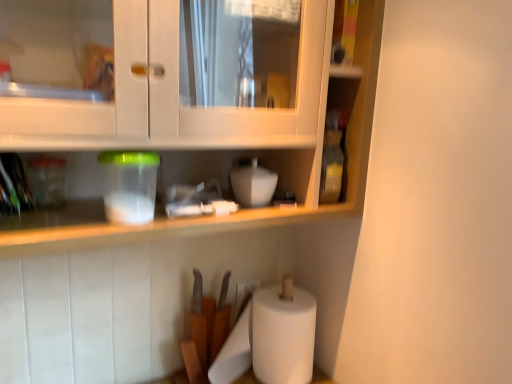
Find the location of a particular element. white matte bowl at center, positioned as the 1th appliance in back-to-front order is located at coordinates (253, 184).

Describe the element at coordinates (253, 184) in the screenshot. I see `white matte bowl at center, positioned as the 1th appliance in back-to-front order` at that location.

Where is `translucent plastic container at upper left, which is the 1th appliance in front-to-back order`? The width and height of the screenshot is (512, 384). translucent plastic container at upper left, which is the 1th appliance in front-to-back order is located at coordinates (129, 185).

What do you see at coordinates (129, 185) in the screenshot? I see `translucent plastic container at upper left, the 2th appliance from the back` at bounding box center [129, 185].

In order to face translucent plastic container at upper left, the 2th appliance from the back, should I rotate leftwards or rightwards?

A 15.944 degree turn to the left will do.

You are a GUI agent. You are given a task and a screenshot of the screen. Output one action in this format:
    pyautogui.click(x=<x>, y=<y>)
    Task: Click on the white matte bowl at center, which appears as the second appliance when viewed from the left
    The image size is (512, 384).
    Given the screenshot: What is the action you would take?
    pyautogui.click(x=253, y=184)

Which object is positioned more to the left, translucent plastic container at upper left, the 2th appliance from the back, or white matte bowl at center, which appears as the second appliance when viewed from the left?

Positioned to the left is translucent plastic container at upper left, the 2th appliance from the back.

Looking at this image, is translucent plastic container at upper left, which is the 1th appliance in front-to-back order, positioned before white matte bowl at center, acting as the 2th appliance starting from the front?

Yes.

Which is less distant, (114,209) or (252,194)?

Point (114,209) appears to be closer to the viewer than point (252,194).

From the image's perspective, between translucent plastic container at upper left, which is the second appliance in right-to-left order, and white matte bowl at center, which appears as the second appliance when viewed from the left, who is located below?

From the image's view, translucent plastic container at upper left, which is the second appliance in right-to-left order, is below.

From a real-world perspective, is translucent plastic container at upper left, the 2th appliance from the back, positioned over white matte bowl at center, acting as the 2th appliance starting from the front, based on gravity?

Yes, from a real-world perspective, translucent plastic container at upper left, the 2th appliance from the back, is above white matte bowl at center, acting as the 2th appliance starting from the front.

Which object is wider, translucent plastic container at upper left, the 2th appliance from the back, or white matte bowl at center, acting as the 2th appliance starting from the front?

translucent plastic container at upper left, the 2th appliance from the back, is wider.

Considering the relative sizes of translucent plastic container at upper left, which is the 1th appliance in front-to-back order, and white matte bowl at center, which is the first appliance in right-to-left order, in the image provided, is translucent plastic container at upper left, which is the 1th appliance in front-to-back order, taller than white matte bowl at center, which is the first appliance in right-to-left order,?

Correct, translucent plastic container at upper left, which is the 1th appliance in front-to-back order, is much taller as white matte bowl at center, which is the first appliance in right-to-left order.

Considering the relative sizes of translucent plastic container at upper left, which is the 1th appliance in front-to-back order, and white matte bowl at center, acting as the 2th appliance starting from the front, in the image provided, is translucent plastic container at upper left, which is the 1th appliance in front-to-back order, smaller than white matte bowl at center, acting as the 2th appliance starting from the front,?

Actually, translucent plastic container at upper left, which is the 1th appliance in front-to-back order, might be larger than white matte bowl at center, acting as the 2th appliance starting from the front.

Is translucent plastic container at upper left, which is the 1th appliance in front-to-back order, situated inside white matte bowl at center, which appears as the second appliance when viewed from the left, or outside?

translucent plastic container at upper left, which is the 1th appliance in front-to-back order, is outside white matte bowl at center, which appears as the second appliance when viewed from the left.

Is translucent plastic container at upper left, which is the 1th appliance in front-to-back order, placed right next to white matte bowl at center, which appears as the second appliance when viewed from the left?

No, translucent plastic container at upper left, which is the 1th appliance in front-to-back order, is not touching white matte bowl at center, which appears as the second appliance when viewed from the left.

Is translucent plastic container at upper left, the 2th appliance from the back, oriented towards white matte bowl at center, which appears as the second appliance when viewed from the left?

No.

Locate an element on the screen. This screenshot has height=384, width=512. appliance below the translucent plastic container at upper left, which is the 1th appliance in front-to-back order (from a real-world perspective) is located at coordinates (253, 184).

From the picture: Can you confirm if white matte bowl at center, acting as the 2th appliance starting from the front, is positioned to the right of translucent plastic container at upper left, which ranks as the first appliance in left-to-right order?

Yes, white matte bowl at center, acting as the 2th appliance starting from the front, is to the right of translucent plastic container at upper left, which ranks as the first appliance in left-to-right order.

Looking at this image, is the depth of white matte bowl at center, which appears as the second appliance when viewed from the left, less than that of translucent plastic container at upper left, which ranks as the first appliance in left-to-right order?

No, white matte bowl at center, which appears as the second appliance when viewed from the left, is further to the viewer.

Is point (248, 185) positioned before point (137, 211)?

No, it is behind (137, 211).

From the image's perspective, is white matte bowl at center, acting as the 2th appliance starting from the front, beneath translucent plastic container at upper left, the 2th appliance from the back?

No, from the image's perspective, white matte bowl at center, acting as the 2th appliance starting from the front, is not beneath translucent plastic container at upper left, the 2th appliance from the back.

From a real-world perspective, which is physically above, white matte bowl at center, acting as the 2th appliance starting from the front, or translucent plastic container at upper left, the 2th appliance from the back?

From a 3D spatial view, translucent plastic container at upper left, the 2th appliance from the back, is above.

Considering the sizes of objects white matte bowl at center, which is the first appliance in right-to-left order, and translucent plastic container at upper left, which is the second appliance in right-to-left order, in the image provided, who is wider, white matte bowl at center, which is the first appliance in right-to-left order, or translucent plastic container at upper left, which is the second appliance in right-to-left order,?

With larger width is translucent plastic container at upper left, which is the second appliance in right-to-left order.

Considering the sizes of white matte bowl at center, positioned as the 1th appliance in back-to-front order, and translucent plastic container at upper left, which is the second appliance in right-to-left order, in the image, is white matte bowl at center, positioned as the 1th appliance in back-to-front order, taller or shorter than translucent plastic container at upper left, which is the second appliance in right-to-left order,?

In the image, white matte bowl at center, positioned as the 1th appliance in back-to-front order, appears to be shorter than translucent plastic container at upper left, which is the second appliance in right-to-left order.

Does white matte bowl at center, positioned as the 1th appliance in back-to-front order, have a larger size compared to translucent plastic container at upper left, which is the 1th appliance in front-to-back order?

No, white matte bowl at center, positioned as the 1th appliance in back-to-front order, is not bigger than translucent plastic container at upper left, which is the 1th appliance in front-to-back order.

Is translucent plastic container at upper left, which is the 1th appliance in front-to-back order, a part of white matte bowl at center, acting as the 2th appliance starting from the front?

No, white matte bowl at center, acting as the 2th appliance starting from the front, does not contain translucent plastic container at upper left, which is the 1th appliance in front-to-back order.

Are white matte bowl at center, acting as the 2th appliance starting from the front, and translucent plastic container at upper left, the 2th appliance from the back, located far from each other?

They are positioned close to each other.

Is white matte bowl at center, which is the first appliance in right-to-left order, aimed at translucent plastic container at upper left, which ranks as the first appliance in left-to-right order?

No, white matte bowl at center, which is the first appliance in right-to-left order, is not facing towards translucent plastic container at upper left, which ranks as the first appliance in left-to-right order.

What's the angular difference between white matte bowl at center, which is the first appliance in right-to-left order, and translucent plastic container at upper left, which is the second appliance in right-to-left order,'s facing directions?

The angular difference between white matte bowl at center, which is the first appliance in right-to-left order, and translucent plastic container at upper left, which is the second appliance in right-to-left order, is 7.32e-05 degrees.

Where is `appliance on the right side of translucent plastic container at upper left, which ranks as the first appliance in left-to-right order`? This screenshot has width=512, height=384. appliance on the right side of translucent plastic container at upper left, which ranks as the first appliance in left-to-right order is located at coordinates (253, 184).

In order to click on appliance located behind the translucent plastic container at upper left, the 2th appliance from the back in this screenshot , I will do `click(253, 184)`.

Locate an element on the screen. The image size is (512, 384). appliance on the left of white matte bowl at center, which appears as the second appliance when viewed from the left is located at coordinates (129, 185).